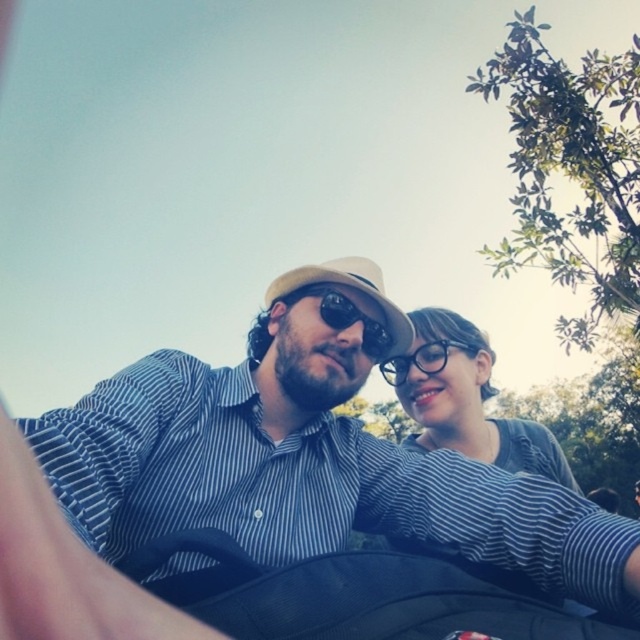
Question: Is blue striped shirt at center closer to camera compared to matte gray shirt at center?

Choices:
 (A) yes
 (B) no

Answer: (A)

Question: Estimate the real-world distances between objects in this image. Which object is farther from the transparent plastic glasses at center?

Choices:
 (A) sunglasses at center
 (B) blue striped shirt at center
 (C) matte gray shirt at center

Answer: (B)

Question: Is blue striped shirt at center to the right of matte gray shirt at center from the viewer's perspective?

Choices:
 (A) yes
 (B) no

Answer: (B)

Question: Which object is closer to the camera taking this photo?

Choices:
 (A) matte gray shirt at center
 (B) blue striped shirt at center

Answer: (B)

Question: Which of the following is the closest to the observer?

Choices:
 (A) blue striped shirt at center
 (B) sunglasses at center
 (C) transparent plastic glasses at center

Answer: (A)

Question: Is sunglasses at center behind transparent plastic glasses at center?

Choices:
 (A) no
 (B) yes

Answer: (A)